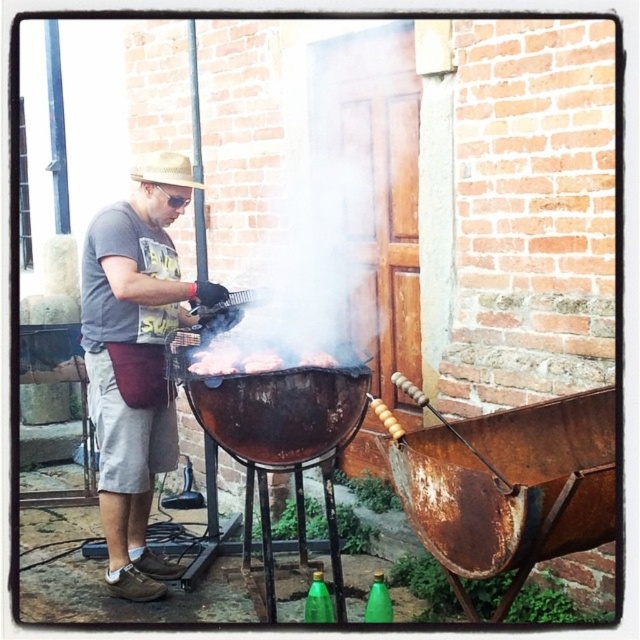
Question: Which point appears closest to the camera in this image?

Choices:
 (A) (156, 156)
 (B) (260, 369)

Answer: (B)

Question: Does white smoke at center have a smaller size compared to charcoal briquettes at center?

Choices:
 (A) yes
 (B) no

Answer: (B)

Question: Is gray cotton shirt at center closer to camera compared to straw hat at upper left?

Choices:
 (A) yes
 (B) no

Answer: (A)

Question: Is smoky charred meat at center behind straw hat at upper left?

Choices:
 (A) no
 (B) yes

Answer: (A)

Question: Which point is closer to the camera taking this photo?

Choices:
 (A) (100, 387)
 (B) (177, 154)
 (C) (326, 241)

Answer: (A)

Question: Which of the following is the closest to the observer?

Choices:
 (A) (260, 369)
 (B) (211, 342)
 (C) (284, 275)

Answer: (A)